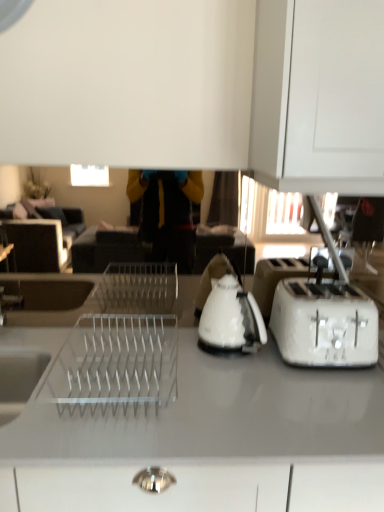
Identify the location of empty space that is ontop of white glossy countertop at center (from a real-world perspective). (188, 392).